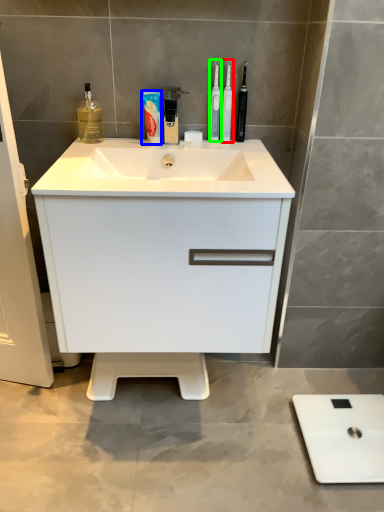
Question: Which is farther away from toothbrush (highlighted by a red box)? toothpaste (highlighted by a blue box) or toothbrush (highlighted by a green box)?

Choices:
 (A) toothpaste
 (B) toothbrush

Answer: (A)